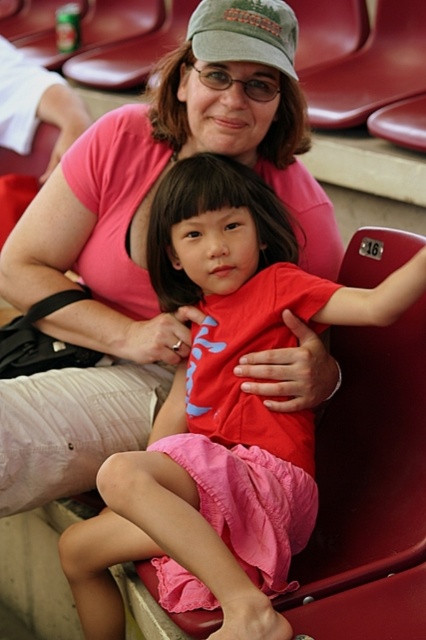
Question: Which point is closer to the camera taking this photo?

Choices:
 (A) (239, 301)
 (B) (150, 321)

Answer: (A)

Question: Considering the real-world distances, which object is closest to the red matte shirt at center?

Choices:
 (A) pink cotton shirt at center
 (B) green fabric cap at upper center

Answer: (A)

Question: Does pink cotton shirt at center have a lesser width compared to green fabric cap at upper center?

Choices:
 (A) no
 (B) yes

Answer: (A)

Question: Is pink cotton shirt at center behind green fabric cap at upper center?

Choices:
 (A) yes
 (B) no

Answer: (A)

Question: Estimate the real-world distances between objects in this image. Which object is farther from the red matte shirt at center?

Choices:
 (A) pink cotton shirt at center
 (B) green fabric cap at upper center

Answer: (B)

Question: Can you confirm if red matte shirt at center is smaller than green fabric cap at upper center?

Choices:
 (A) yes
 (B) no

Answer: (B)